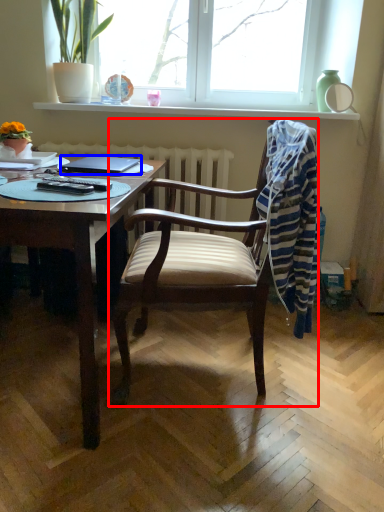
Question: Which object appears closest to the camera in this image, chair (highlighted by a red box) or laptop (highlighted by a blue box)?

Choices:
 (A) chair
 (B) laptop

Answer: (A)